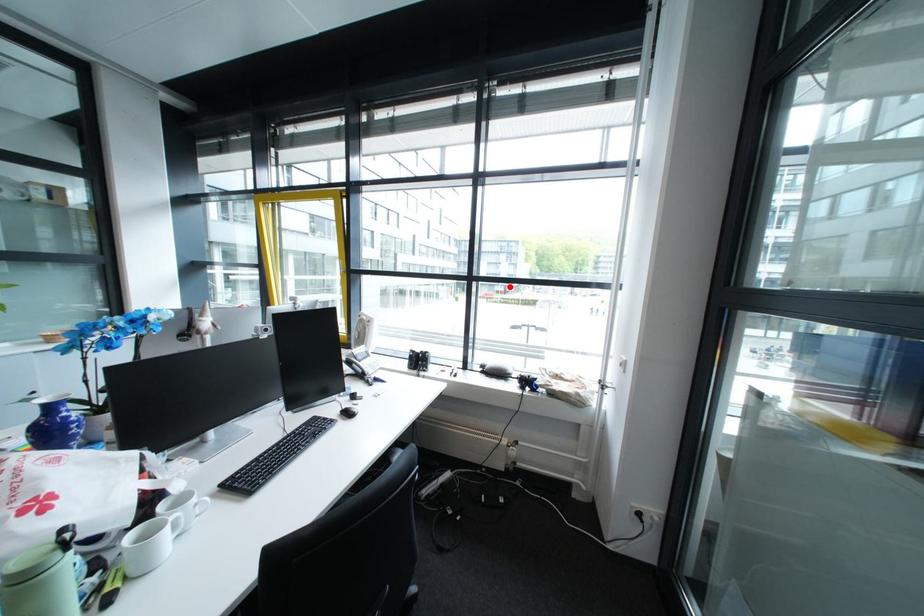
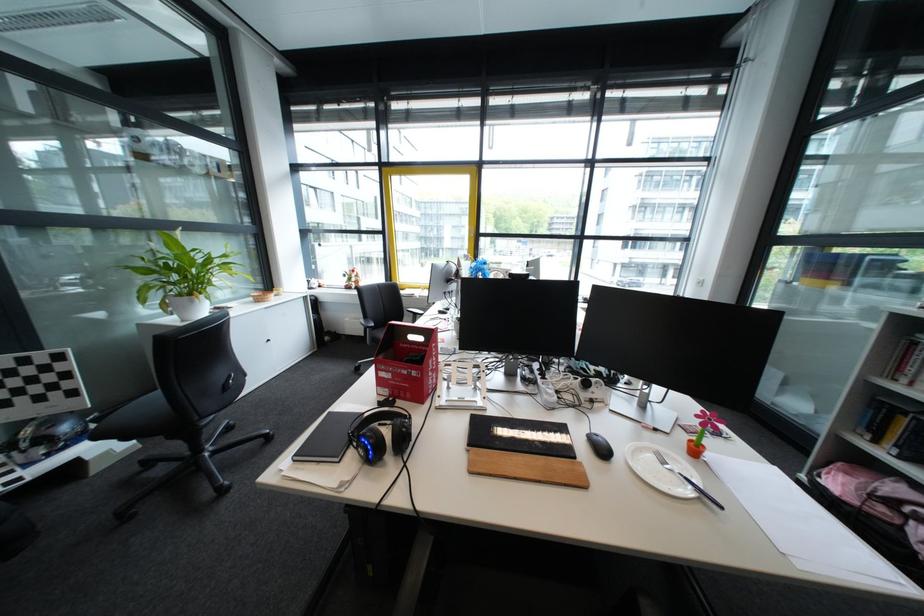
Where in the second image is the point corresponding to the highlighted location from the first image?

(472, 251)